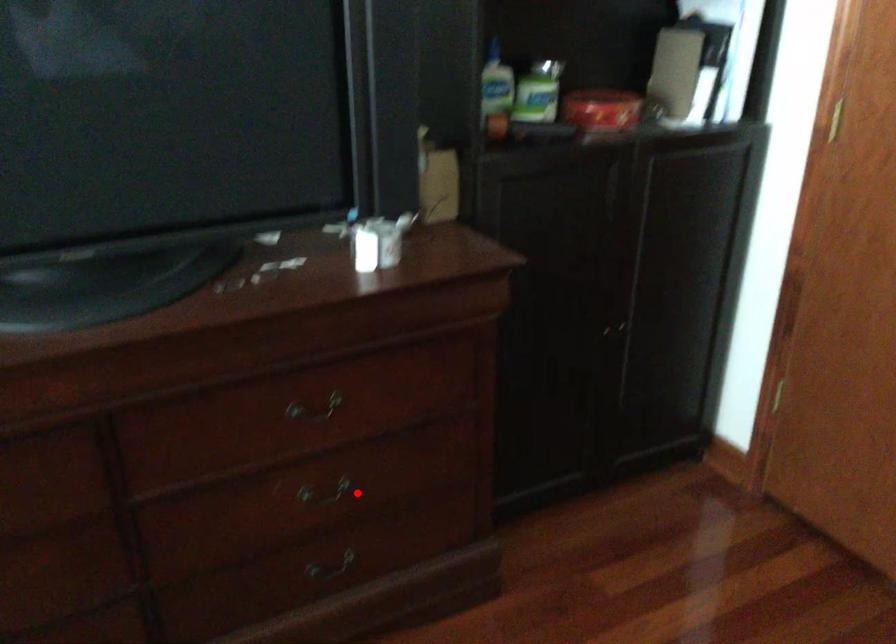
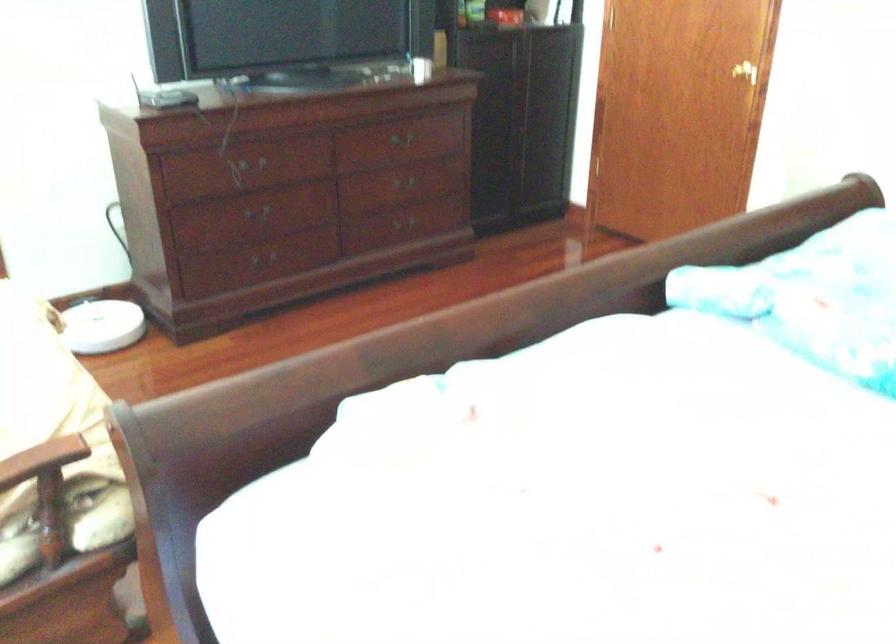
Where in the second image is the point corresponding to the highlighted location from the first image?

(409, 187)